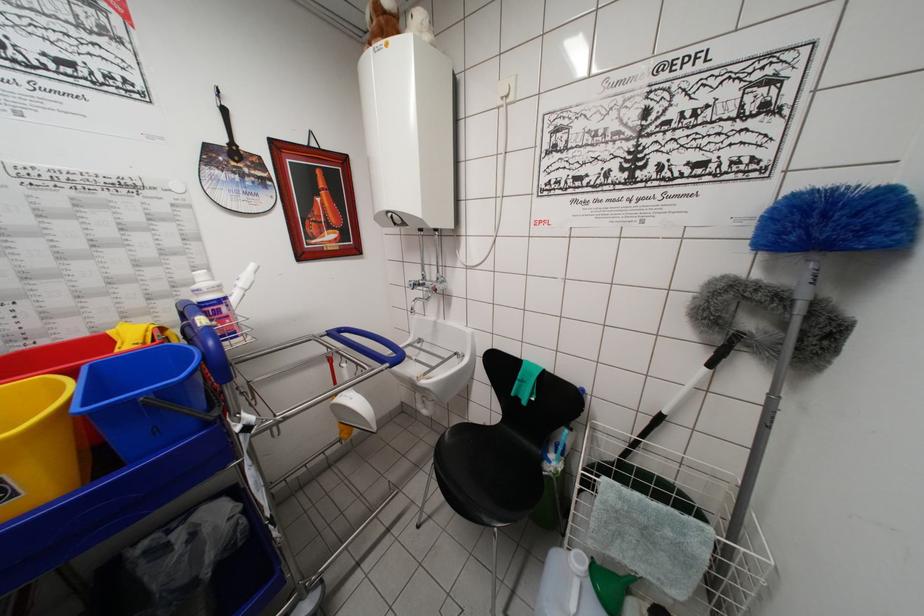
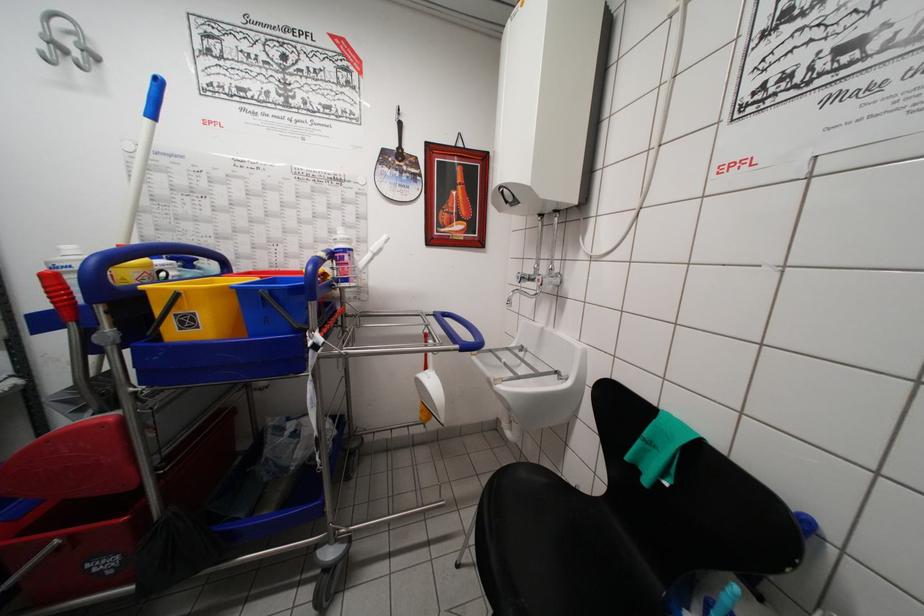
The point at (414, 290) is marked in the first image. Where is the corresponding point in the second image?

(521, 282)